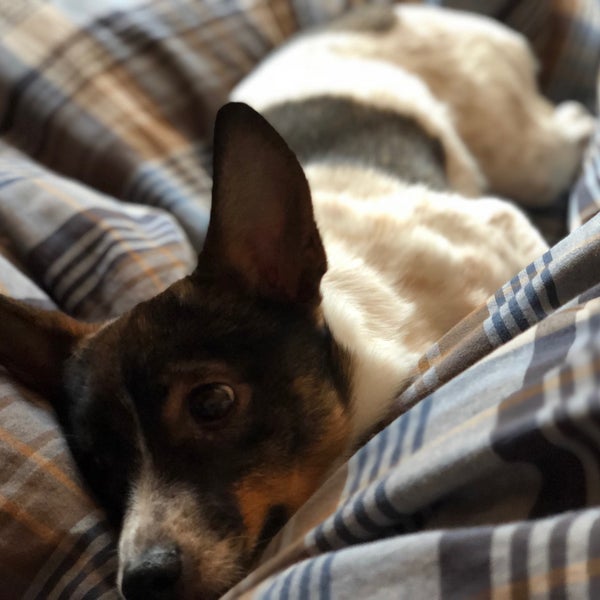
Identify the location of blanket. (467, 497), (45, 412), (187, 22), (580, 76).